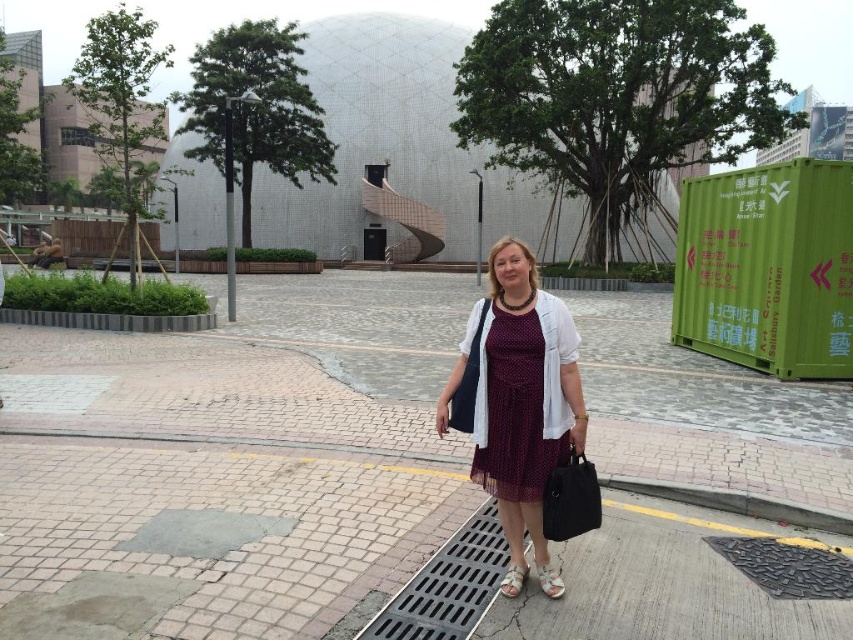
You are a customer at a shoe store looking to buy a pair of sandals. You see two options in the image, a white textured sandal at lower center and a white fabric sandal at lower center. Which one has a higher heel?

The white textured sandal at lower center has a greater height compared to the white fabric sandal at lower center, so the white textured sandal at lower center has a higher heel.

You are a photographer planning to take a picture of the modern architectural structure in the background. You notice a woman wearing a burgundy dotted dress at center in the scene. To avoid including her in your photo, where should you position yourself relative to the drainage grate in the bottom center?

The burgundy dotted dress at center is located at point (x=517, y=392). To avoid including her in the photo, position yourself such that the drainage grate in the bottom center is between you and the dress.